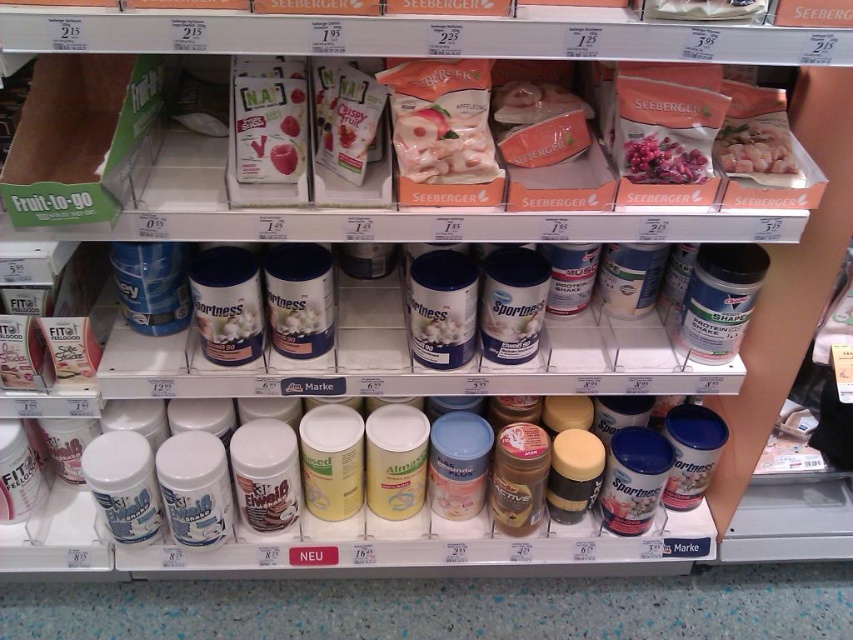
You are standing in front of the grocery store shelf and want to reach an item located at point (758, 172). Your arm can extend 0.9 meters. Can you reach it?

The distance between you and the point is 1.03 meters, which is beyond your arm extension of 0.9 meters. You cannot reach the item at point (758, 172).

You are standing in front of the grocery store shelf and want to reach a specific item located at point (473, 99). Your arm can extend 36 inches. Can you reach it?

The point (473, 99) is 37.91 inches from the viewer, which is slightly beyond your arm extension of 36 inches. You cannot reach it with your arm.

You are a grocery store employee who needs to restock the shelves. You have a new batch of yogurt that needs to be placed below the white glossy chicken at upper right. Where should you position the new yogurt in relation to the existing matte white yogurt at center?

The white glossy chicken at upper right is located above the matte white yogurt at center. Therefore, to place the new yogurt below the white glossy chicken at upper right, you should position it at the same level as the existing matte white yogurt at center.